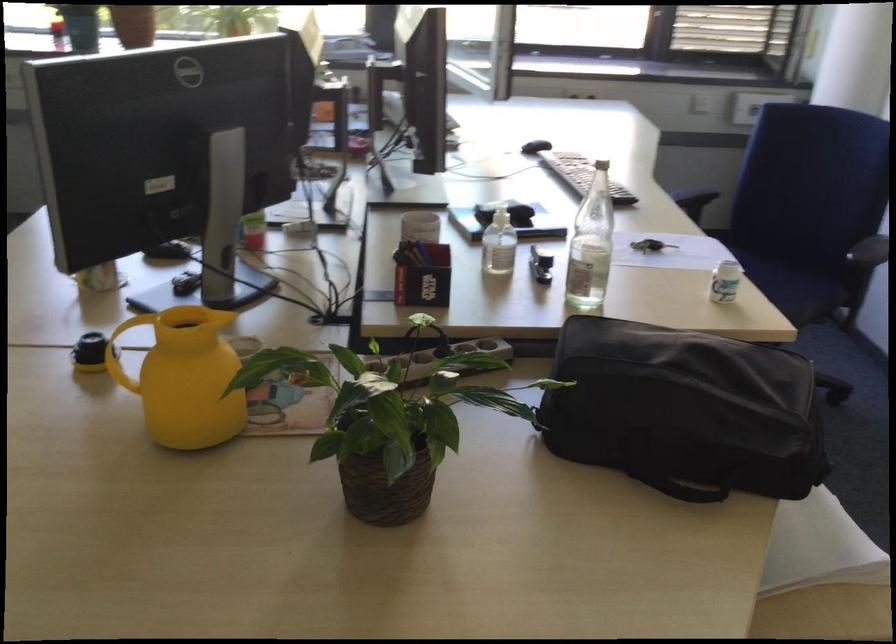
Where would you press the sanitizer bottle pump? Please return your answer as a coordinate pair (x, y).

(185, 377)